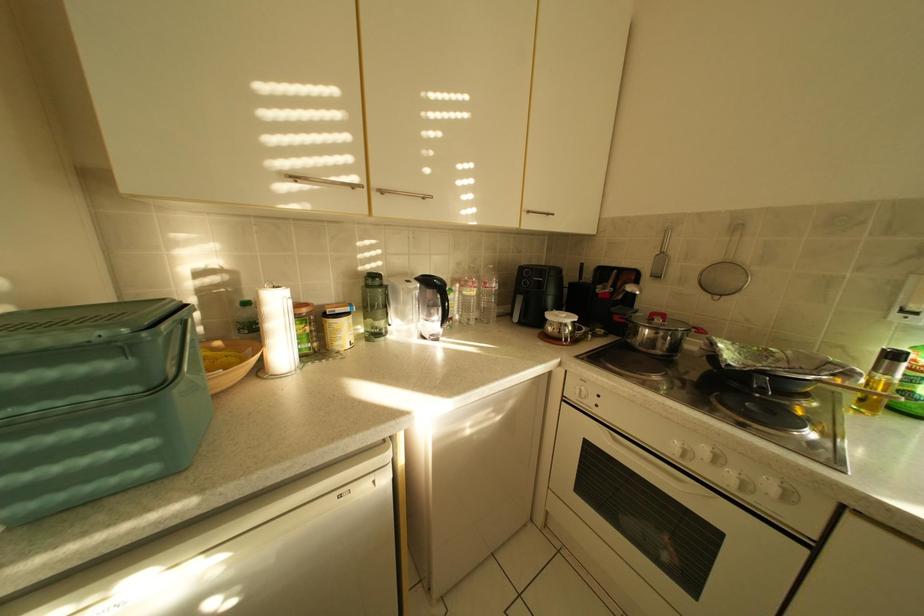
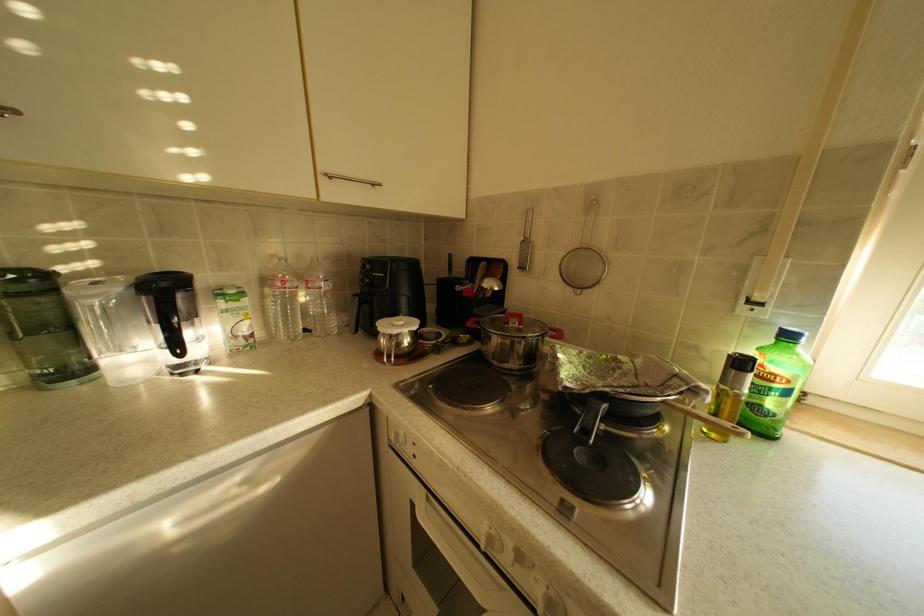
Which direction would the cameraman need to move to produce the second image?

The cameraman walked toward right, forward.